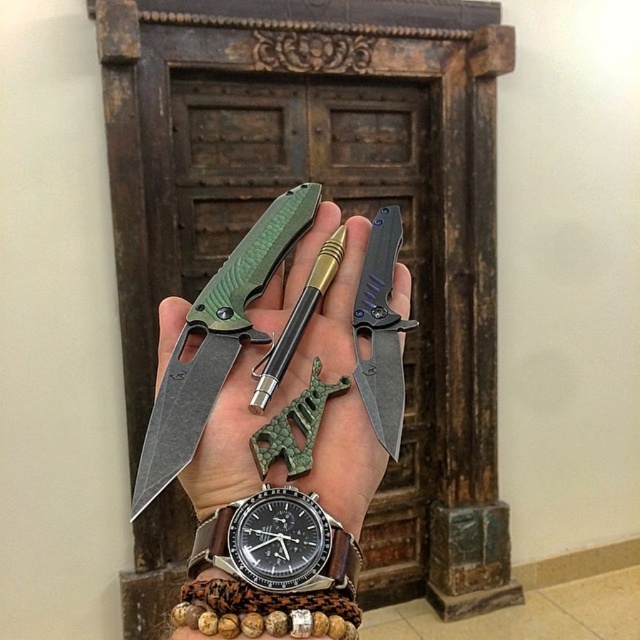
Question: Among these points, which one is nearest to the camera?

Choices:
 (A) (188, 416)
 (B) (280, 525)
 (C) (388, 432)

Answer: (B)

Question: Which point is closer to the camera?

Choices:
 (A) black leather watch at center
 (B) matte black knife at center
 (C) green textured knife at center
 (D) dark gray matte knife at center

Answer: (B)

Question: Can you confirm if green textured knife at center is wider than black leather watch at center?

Choices:
 (A) yes
 (B) no

Answer: (A)

Question: Can you confirm if matte black knife at center is thinner than black leather watch at center?

Choices:
 (A) no
 (B) yes

Answer: (A)

Question: Is matte black knife at center positioned in front of black leather watch at center?

Choices:
 (A) no
 (B) yes

Answer: (B)

Question: Which object is positioned closest to the dark gray matte knife at center?

Choices:
 (A) green textured knife at center
 (B) matte black knife at center
 (C) black leather watch at center

Answer: (B)